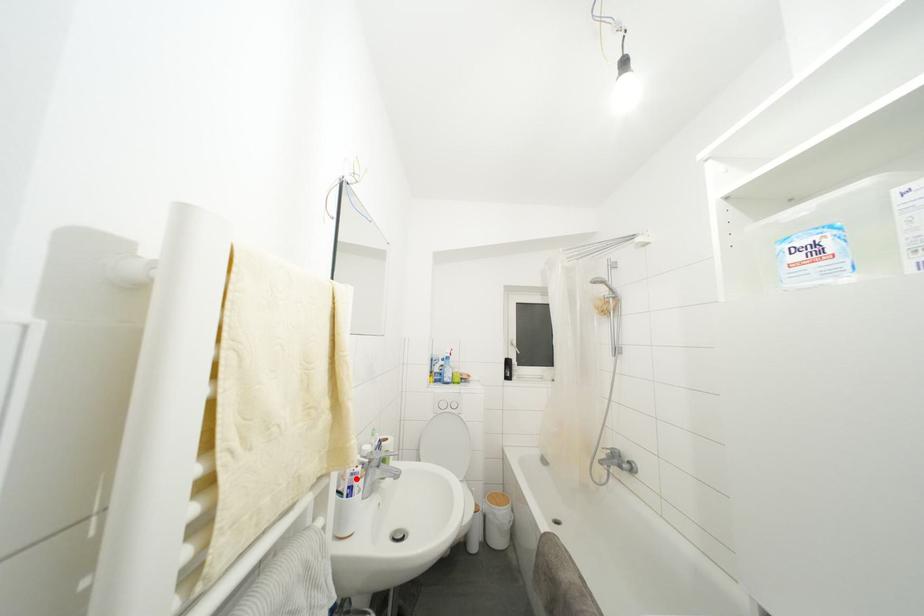
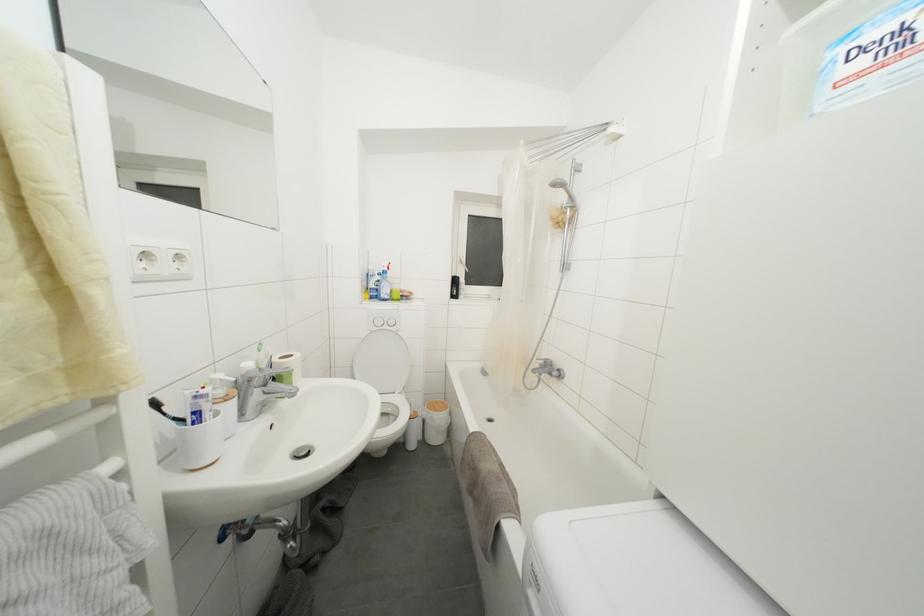
Find the pixel in the second image that matches the highlighted location in the first image.

(200, 402)